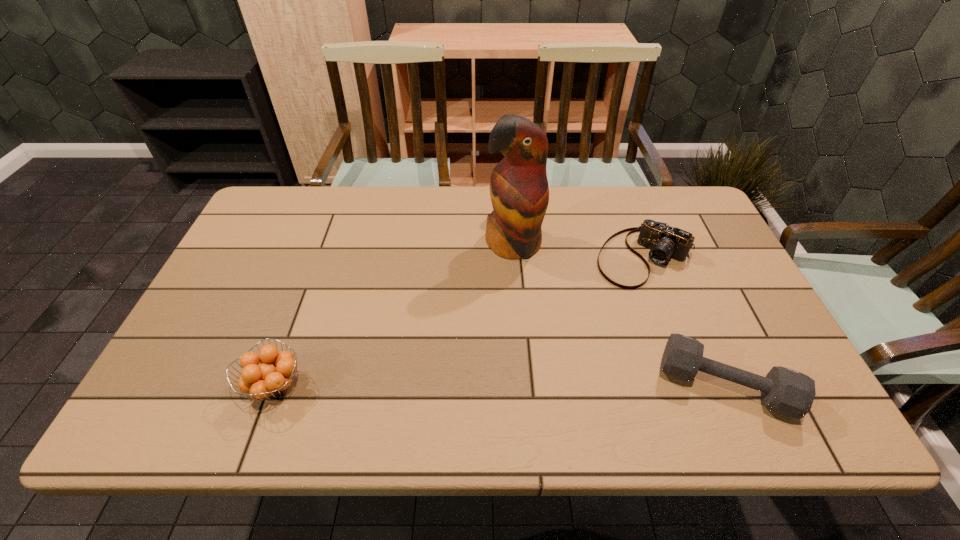
Find the location of a particular element. The height and width of the screenshot is (540, 960). vacant region that satisfies the following two spatial constraints: 1. on the front side of the dumbbell; 2. on the left side of the tallest object is located at coordinates point(524,385).

The height and width of the screenshot is (540, 960). What are the coordinates of `free spot that satisfies the following two spatial constraints: 1. on the front side of the second object from left to right; 2. on the right side of the dumbbell` in the screenshot? It's located at (524, 385).

Where is `vacant space that satisfies the following two spatial constraints: 1. on the back side of the camera; 2. on the right side of the leftmost object`? This screenshot has height=540, width=960. vacant space that satisfies the following two spatial constraints: 1. on the back side of the camera; 2. on the right side of the leftmost object is located at coordinates (321, 258).

The width and height of the screenshot is (960, 540). Find the location of `free spot that satisfies the following two spatial constraints: 1. on the back side of the dumbbell; 2. on the right side of the leftmost object`. free spot that satisfies the following two spatial constraints: 1. on the back side of the dumbbell; 2. on the right side of the leftmost object is located at coordinates (275, 385).